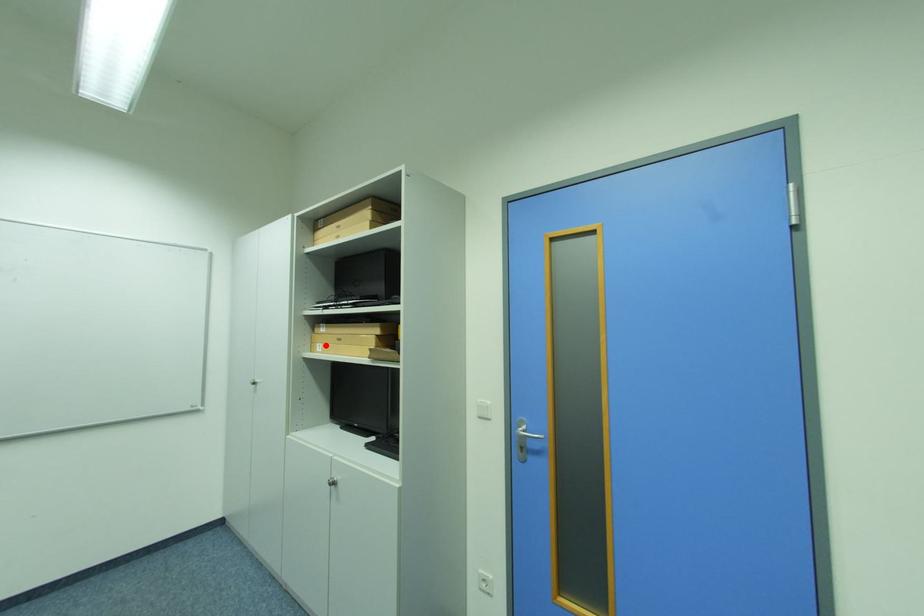
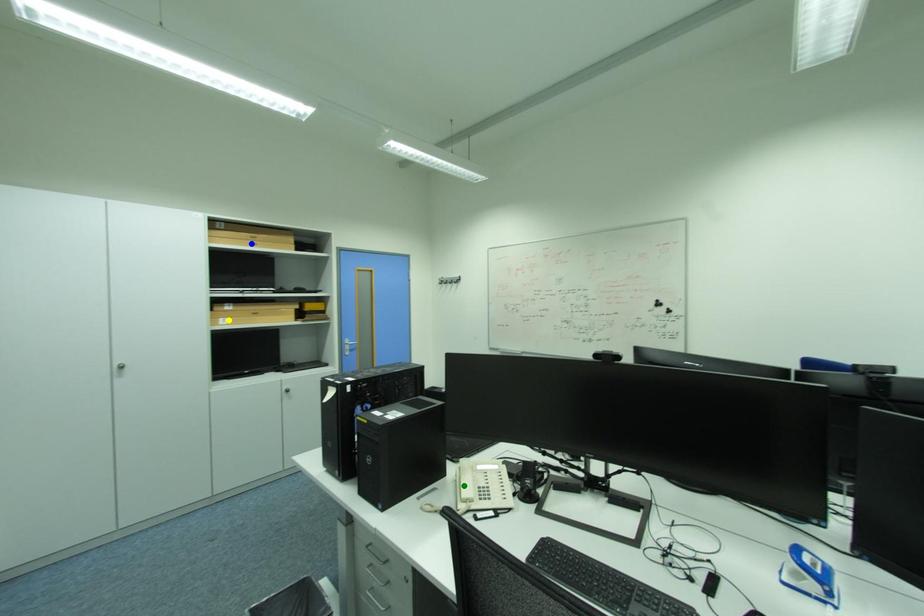
Question: I am providing you with two images of the same scene from different viewpoints. A red point is marked on the first image. You are given multiple points on the second image. In image 2, which mark is for the same physical point as the one in image 1?

Choices:
 (A) green point
 (B) blue point
 (C) yellow point

Answer: (C)